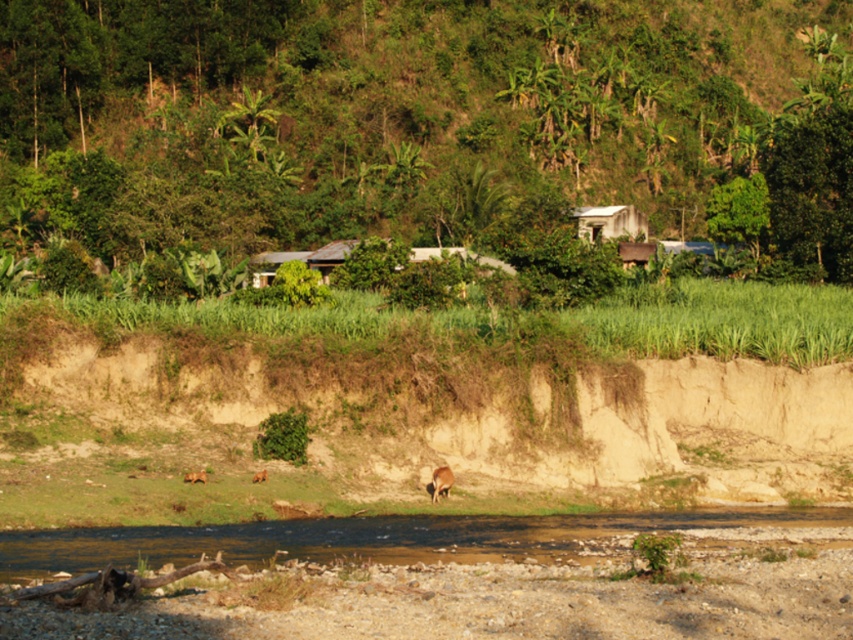
Is green leafy hillside at upper center thinner than brown furry dog at center?

Incorrect, green leafy hillside at upper center's width is not less than brown furry dog at center's.

Who is shorter, green leafy hillside at upper center or brown furry dog at center?

brown furry dog at center

Is point (126, 220) closer to viewer compared to point (436, 493)?

That is False.

Where is `green leafy hillside at upper center`? The height and width of the screenshot is (640, 853). green leafy hillside at upper center is located at coordinates (416, 115).

Between point (579, 212) and point (432, 472), which one is positioned behind?

The point (579, 212) is behind.

Does white corrugated metal hut at upper center appear over brown furry dog at center?

Yes.

Based on the photo, measure the distance between white corrugated metal hut at upper center and camera.

The distance of white corrugated metal hut at upper center from camera is 341.00 feet.

Find the location of a particular element. Image resolution: width=853 pixels, height=640 pixels. white corrugated metal hut at upper center is located at coordinates (608, 221).

Which is more to the right, brown gravel river at lower center or white corrugated metal hut at upper center?

From the viewer's perspective, white corrugated metal hut at upper center appears more on the right side.

Can you confirm if brown gravel river at lower center is wider than white corrugated metal hut at upper center?

Yes.

Locate an element on the screen. This screenshot has height=640, width=853. brown gravel river at lower center is located at coordinates (392, 538).

Where is `brown gravel river at lower center`? The image size is (853, 640). brown gravel river at lower center is located at coordinates (392, 538).